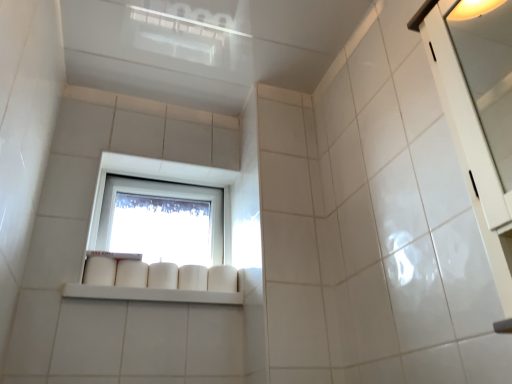
Question: Is white glossy shelf at center facing towards transparent glass window at center?

Choices:
 (A) no
 (B) yes

Answer: (A)

Question: Does white glossy shelf at center have a lesser height compared to transparent glass window at center?

Choices:
 (A) no
 (B) yes

Answer: (B)

Question: From the image's perspective, is white glossy shelf at center on transparent glass window at center?

Choices:
 (A) yes
 (B) no

Answer: (B)

Question: From a real-world perspective, is white glossy shelf at center on transparent glass window at center?

Choices:
 (A) yes
 (B) no

Answer: (B)

Question: Considering the relative sizes of white glossy shelf at center and transparent glass window at center in the image provided, is white glossy shelf at center thinner than transparent glass window at center?

Choices:
 (A) no
 (B) yes

Answer: (A)

Question: Is white glossy cabinet at right wider or thinner than white glossy shelf at center?

Choices:
 (A) wide
 (B) thin

Answer: (B)

Question: From the image's perspective, is white glossy cabinet at right above or below white glossy shelf at center?

Choices:
 (A) below
 (B) above

Answer: (B)

Question: Considering their positions, is white glossy cabinet at right located in front of or behind white glossy shelf at center?

Choices:
 (A) front
 (B) behind

Answer: (A)

Question: Considering the positions of white glossy cabinet at right and white glossy shelf at center in the image, is white glossy cabinet at right taller or shorter than white glossy shelf at center?

Choices:
 (A) short
 (B) tall

Answer: (B)

Question: Is transparent glass window at center bigger or smaller than white glossy shelf at center?

Choices:
 (A) small
 (B) big

Answer: (B)

Question: From a real-world perspective, is transparent glass window at center positioned above or below white glossy shelf at center?

Choices:
 (A) above
 (B) below

Answer: (A)

Question: From the image's perspective, is transparent glass window at center located above or below white glossy shelf at center?

Choices:
 (A) below
 (B) above

Answer: (B)

Question: Based on their positions, is transparent glass window at center located to the left or right of white glossy shelf at center?

Choices:
 (A) right
 (B) left

Answer: (B)

Question: Relative to white glossy cabinet at right, is white glossy shelf at center in front or behind?

Choices:
 (A) behind
 (B) front

Answer: (A)

Question: From a real-world perspective, is white glossy shelf at center above or below white glossy cabinet at right?

Choices:
 (A) below
 (B) above

Answer: (A)